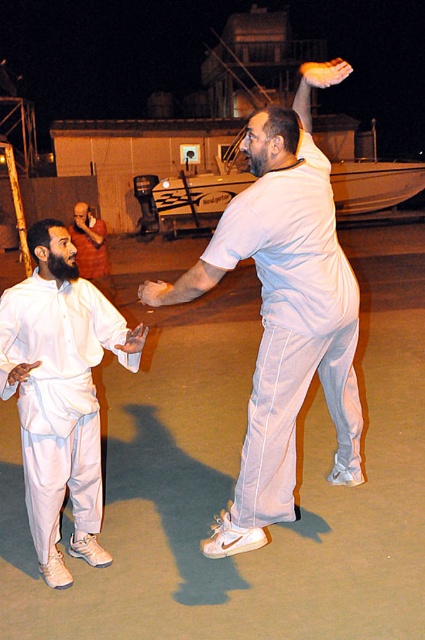
Is white matte pants at center further to the viewer compared to smooth golden hand at upper center?

No, white matte pants at center is closer to the viewer.

Does white matte pants at center appear on the right side of smooth golden hand at upper center?

In fact, white matte pants at center is to the left of smooth golden hand at upper center.

Identify the location of white matte pants at center. (286, 317).

The image size is (425, 640). Identify the location of white matte pants at center. (286, 317).

Which is more to the left, white fiberglass boat at center or matte white shirt at center?

Positioned to the left is matte white shirt at center.

Does white fiberglass boat at center have a greater width compared to matte white shirt at center?

In fact, white fiberglass boat at center might be narrower than matte white shirt at center.

Does point (195, 177) come closer to viewer compared to point (93, 227)?

No, (195, 177) is behind (93, 227).

The width and height of the screenshot is (425, 640). In order to click on white fiberglass boat at center in this screenshot , I will do `click(373, 186)`.

Is white matte pants at center above white fiberglass boat at center?

Actually, white matte pants at center is below white fiberglass boat at center.

Is white matte pants at center positioned at the back of white fiberglass boat at center?

No, it is in front of white fiberglass boat at center.

Is point (257, 397) positioned behind point (343, 163)?

No, it is in front of (343, 163).

Find the location of a particular element. white matte pants at center is located at coordinates (286, 317).